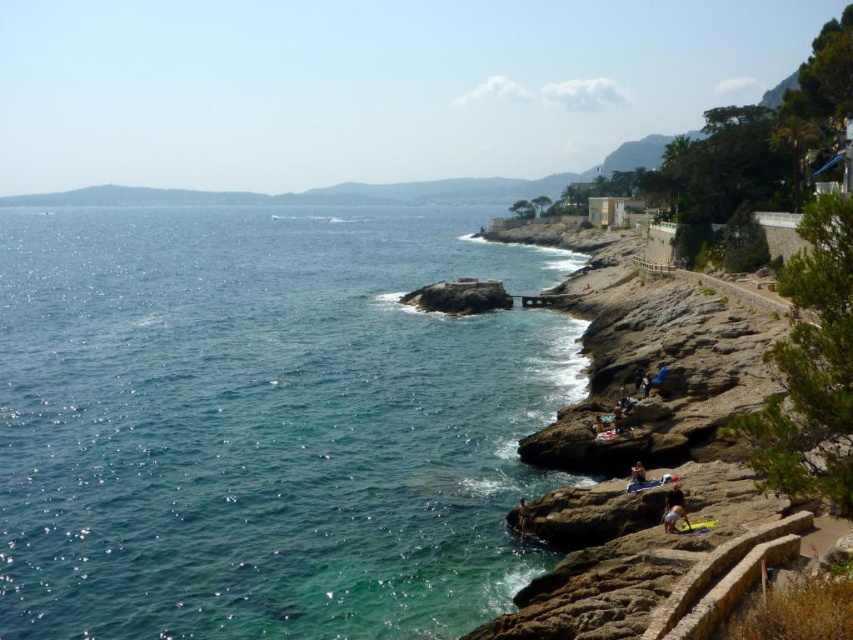
You are standing at the edge of the rocky cliffs in the coastal scene and notice the light blue denim shorts at lower center. Based on their position, can you estimate how far they are from the cliffs?

The light blue denim shorts at lower center are located at point (674,518), which is relatively close to the cliffs, indicating they are near the lower center area of the scene.

You are standing at the center of the beach and want to reach the brown rock at lower right located at point (636, 444). Which direction should you head towards?

You should head towards the lower right direction to reach the brown rock at lower right located at point (636, 444).

You are standing at the camera position and looking at the coastal scene. There are two points marked in the image, point (679,513) and point (637,477). Which point is closer to you?

Point (679,513) is closer to the camera than point (637,477).